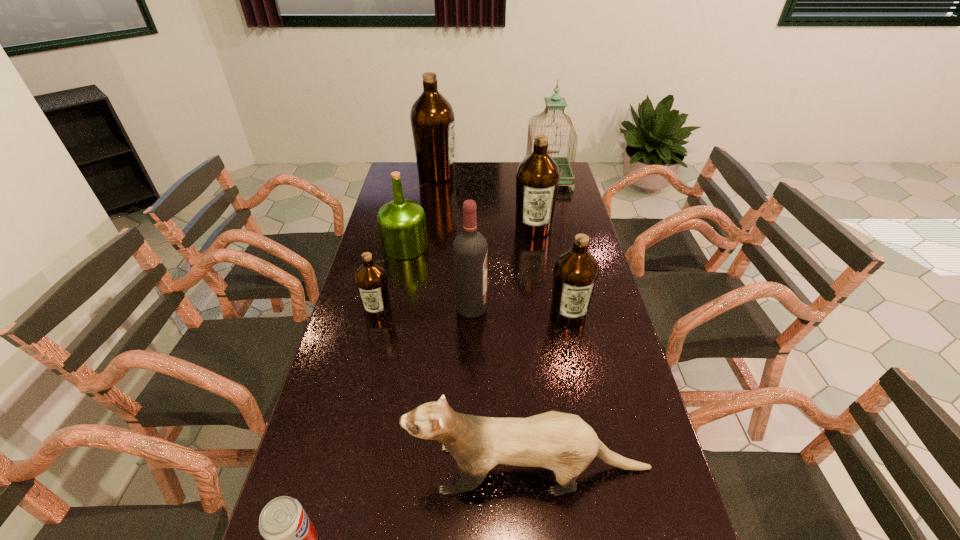
This screenshot has height=540, width=960. Identify the location of vacant space that's between the green olive oil and the birdcage. (476, 213).

This screenshot has height=540, width=960. Identify the location of free space that is in between the birdcage and the wine bottle. (510, 243).

Where is `unoccupied area between the second smallest brown olive oil and the greenish birdcage`? unoccupied area between the second smallest brown olive oil and the greenish birdcage is located at coordinates (558, 247).

Where is `vacant region between the birdcage and the green olive oil`? vacant region between the birdcage and the green olive oil is located at coordinates (476, 213).

Where is `vacant space in between the second nearest object and the wine bottle`? The width and height of the screenshot is (960, 540). vacant space in between the second nearest object and the wine bottle is located at coordinates (500, 388).

Locate an element on the screen. unoccupied position between the wine bottle and the second smallest brown olive oil is located at coordinates (519, 311).

Locate an element on the screen. free area in between the smallest brown olive oil and the green olive oil is located at coordinates click(392, 279).

This screenshot has height=540, width=960. What are the coordinates of `object that is the closest one to the wine bottle` in the screenshot? It's located at (576, 271).

Locate an element on the screen. The width and height of the screenshot is (960, 540). the eighth closest object to the wine bottle is located at coordinates (432, 118).

I want to click on the fourth closest olive oil to the greenish birdcage, so click(576, 271).